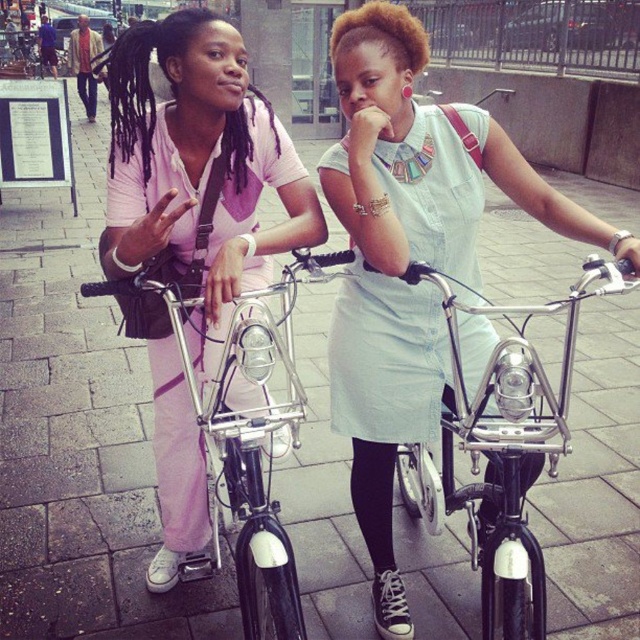
In the scene shown: You are a delivery person who needs to place a 60 cm wide package between the shiny chrome bicycle at center and the brushed metal bicycle at left. Can the package fit between them?

The distance between the shiny chrome bicycle at center and the brushed metal bicycle at left is 58.07 centimeters, so the 60 cm wide package cannot fit between them as it is wider than the available space.

You are a photographer trying to capture a photo of the light blue dress at center and the shiny chrome bicycle at center. Which object should you focus on first if you want to ensure both are in focus without moving the camera?

The light blue dress at center is taller than the shiny chrome bicycle at center, so focusing on the light blue dress at center first will help ensure both are in focus since it is larger in the frame.